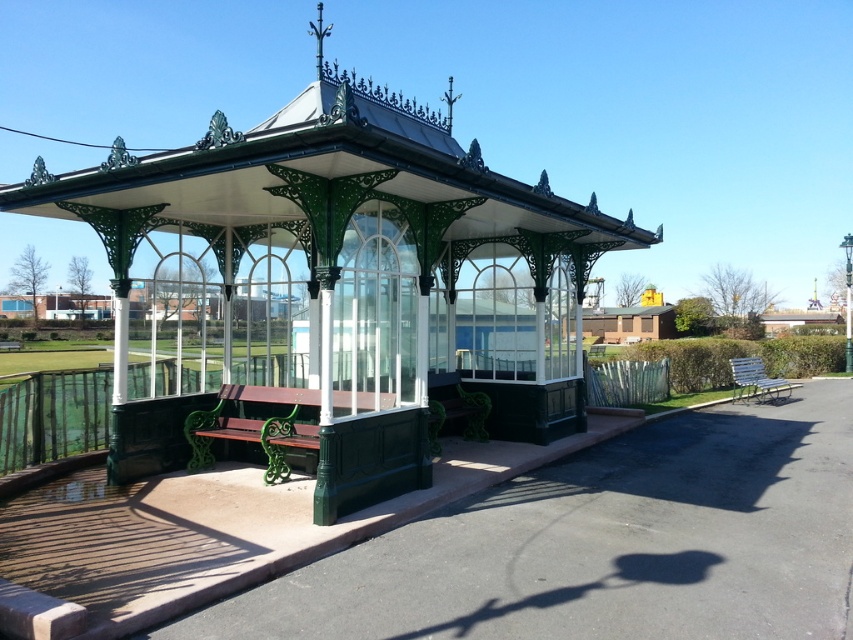
You are standing in the park and want to take a photo of both the green wrought iron gazebo at center and the metallic silver bench at right. Which object should you position closer to the camera to ensure both are in focus?

To ensure both the green wrought iron gazebo at center and the metallic silver bench at right are in focus, position the camera closer to the green wrought iron gazebo at center since it is nearer to the viewer than the metallic silver bench at right. This will help maintain depth of field for both subjects.

You are a painter standing on the wooden bench at center to paint the green wrought iron gazebo at center. Can you reach the top of the gazebo without any additional tools?

The green wrought iron gazebo at center is much taller than the wooden bench at center, so you cannot reach the top of the gazebo while standing on the wooden bench at center without additional tools.